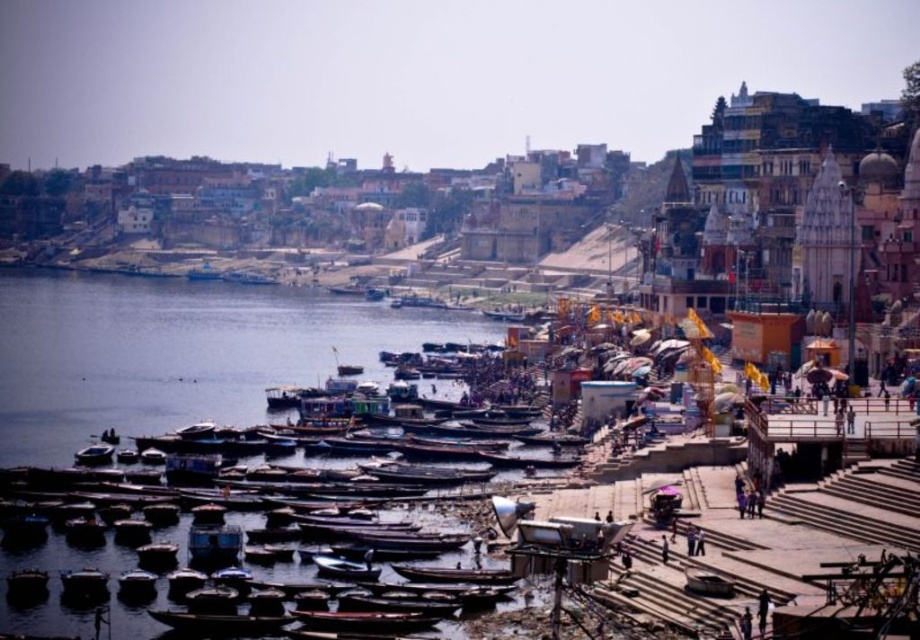
Can you confirm if wooden boat at lower left is wider than wooden boat at center?

In fact, wooden boat at lower left might be narrower than wooden boat at center.

Which is in front, point (42, 588) or point (357, 282)?

Positioned in front is point (42, 588).

Locate an element on the screen. The height and width of the screenshot is (640, 920). wooden boat at lower left is located at coordinates (27, 580).

Can you confirm if brown wooden boats at lower left is shorter than wooden boats at center?

In fact, brown wooden boats at lower left may be taller than wooden boats at center.

Between brown wooden boats at lower left and wooden boats at center, which one appears on the left side from the viewer's perspective?

brown wooden boats at lower left is more to the left.

Is point (63, 456) closer to camera compared to point (96, 356)?

Yes, point (63, 456) is closer to viewer.

At what (x,y) coordinates should I click in order to perform the action: click on brown wooden boats at lower left. Please return your answer as a coordinate pair (x, y). This screenshot has height=640, width=920. Looking at the image, I should click on (177, 353).

Is wooden boat at lower right closer to camera compared to metallic blue boat at center?

That is True.

Is wooden boat at lower right shorter than metallic blue boat at center?

Correct, wooden boat at lower right is not as tall as metallic blue boat at center.

Who is more forward, [685,573] or [196,280]?

Point [685,573] is more forward.

You are a GUI agent. You are given a task and a screenshot of the screen. Output one action in this format:
    pyautogui.click(x=<x>, y=<y>)
    Task: Click on the wooden boat at lower right
    The width and height of the screenshot is (920, 640).
    Given the screenshot: What is the action you would take?
    pyautogui.click(x=707, y=582)